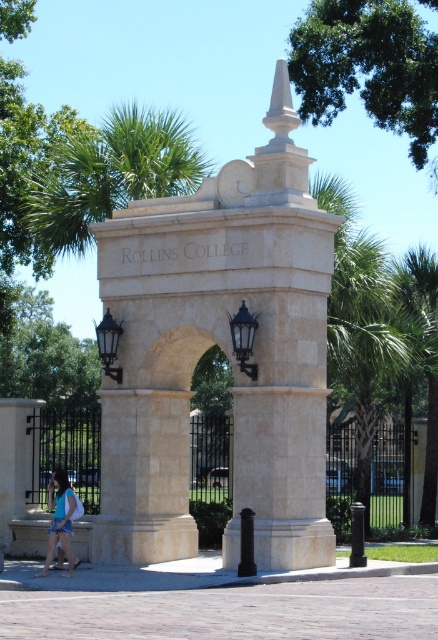
You are standing at the entrance of Rollins College and want to take a photo of the beige stone arch at center. If you are positioned at point 0.5, 0.5, which direction should you move to get the arch in your camera frame?

Since the beige stone arch at center is located at point (225, 353), you should move slightly to the right and forward to align with the arch. The coordinates indicate it is northeast of your current position at (219, 320).

You are standing at the entrance of Rollins College and want to locate the green leafy tree at upper center. According to the coordinates provided, where should you look to find it?

The green leafy tree at upper center is located at point coordinates of 0.105 on the x axis and 0.840 on the y axis.